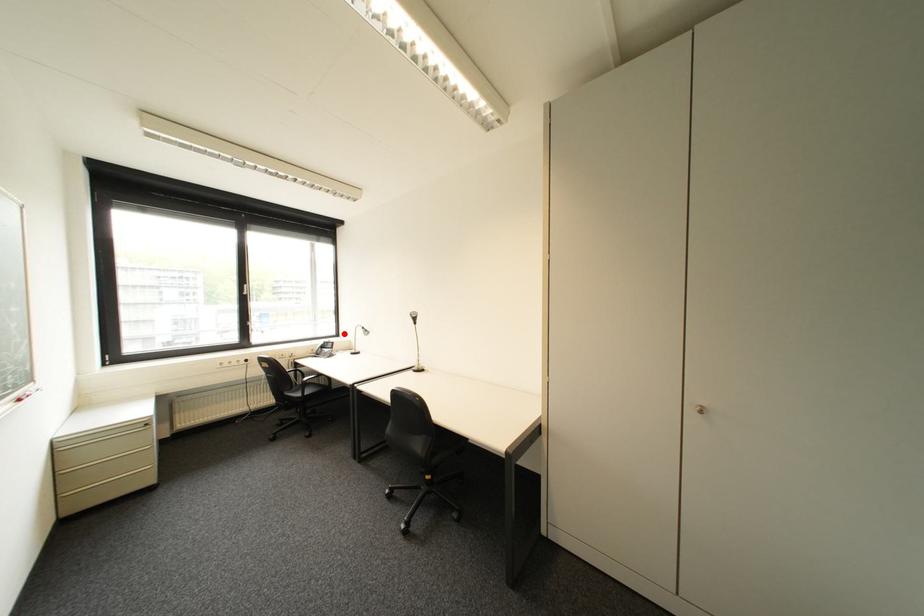
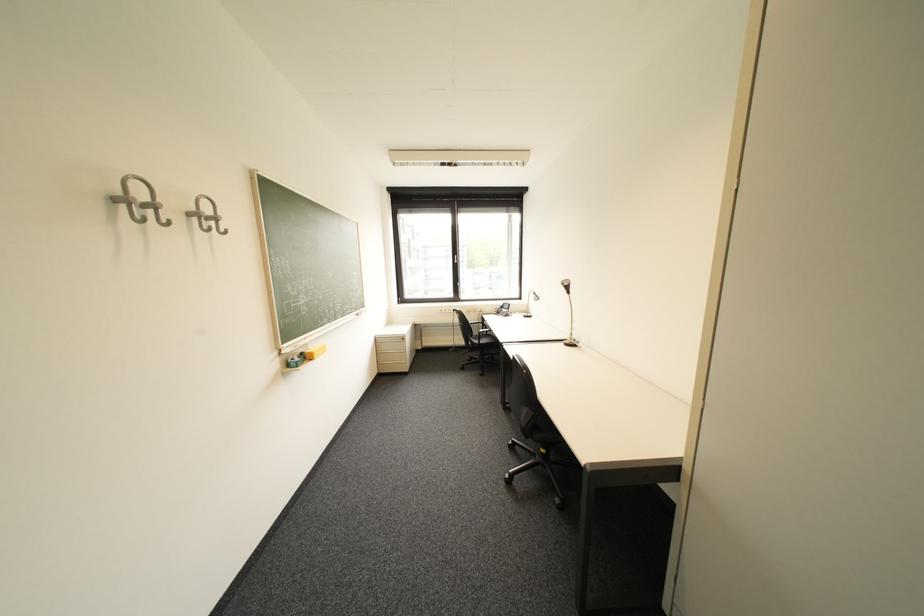
Find the pixel in the second image that matches the highlighted location in the first image.

(528, 297)